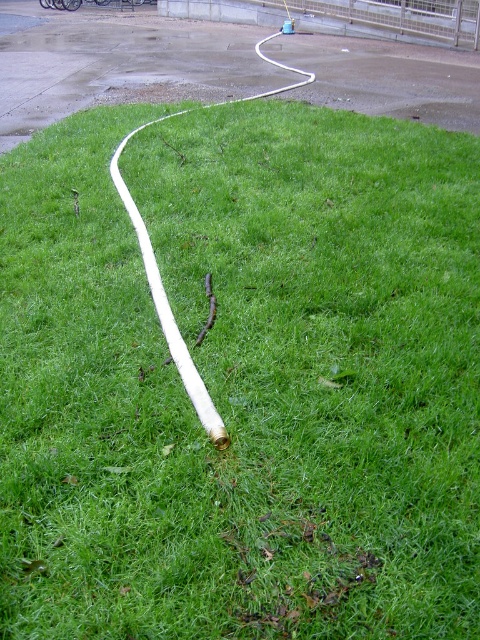
Is white rubber hose at upper center closer to the viewer compared to white rubber hose at center?

No, it is not.

Consider the image. Can you confirm if white rubber hose at upper center is taller than white rubber hose at center?

Indeed, white rubber hose at upper center has a greater height compared to white rubber hose at center.

This screenshot has height=640, width=480. I want to click on white rubber hose at upper center, so click(120, 65).

You are a GUI agent. You are given a task and a screenshot of the screen. Output one action in this format:
    pyautogui.click(x=<x>, y=<y>)
    Task: Click on the white rubber hose at upper center
    
    Given the screenshot: What is the action you would take?
    pyautogui.click(x=120, y=65)